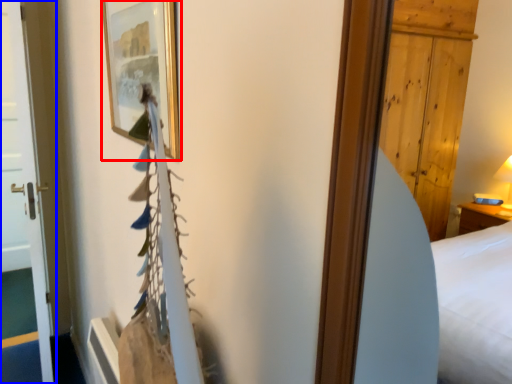
Question: Which point is closer to the camera, picture frame (highlighted by a red box) or door (highlighted by a blue box)?

Choices:
 (A) picture frame
 (B) door

Answer: (A)